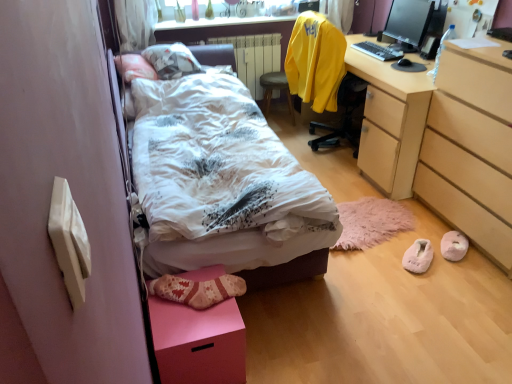
Locate an element on the screen. free spot above peachy suede slippers at lower right, which is the first footwear in right-to-left order (from a real-world perspective) is located at coordinates (455, 235).